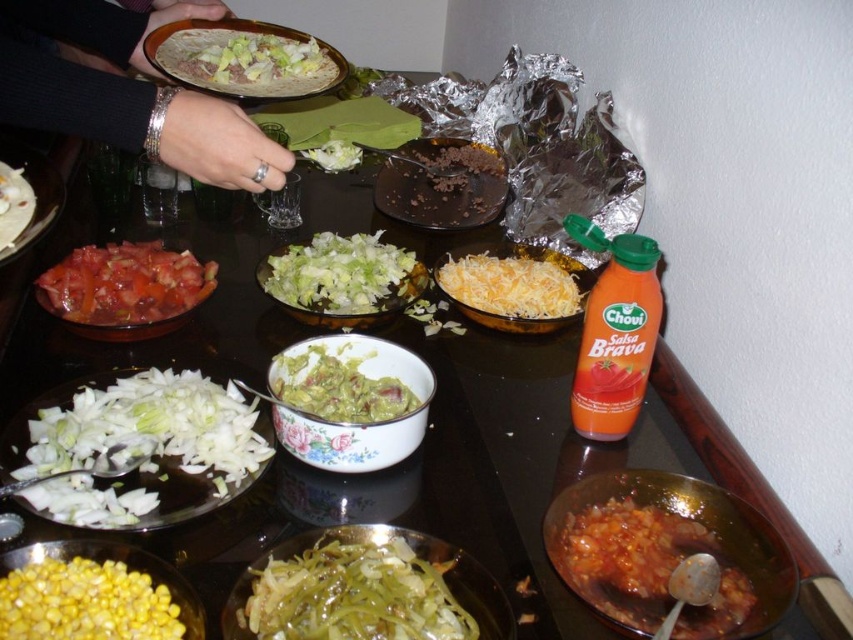
Does white sliced onion at lower left have a greater height compared to green translucent onions at center?

Yes, white sliced onion at lower left is taller than green translucent onions at center.

Does white sliced onion at lower left have a lesser width compared to green translucent onions at center?

No.

The height and width of the screenshot is (640, 853). What do you see at coordinates (146, 449) in the screenshot? I see `white sliced onion at lower left` at bounding box center [146, 449].

At what (x,y) coordinates should I click in order to perform the action: click on white sliced onion at lower left. Please return your answer as a coordinate pair (x, y). The image size is (853, 640). Looking at the image, I should click on (146, 449).

Is green translucent onions at center positioned before white chopped onions at lower left?

Yes, it is in front of white chopped onions at lower left.

Is green translucent onions at center smaller than white chopped onions at lower left?

Indeed, green translucent onions at center has a smaller size compared to white chopped onions at lower left.

Describe the element at coordinates (354, 593) in the screenshot. I see `green translucent onions at center` at that location.

Locate an element on the screen. This screenshot has height=640, width=853. green translucent onions at center is located at coordinates (354, 593).

Between green translucent onions at center and white shredded object at center, which one has less height?

green translucent onions at center

Is green translucent onions at center bigger than white shredded object at center?

Actually, green translucent onions at center might be smaller than white shredded object at center.

Is point (338, 637) less distant than point (302, 301)?

Yes, it is.

Where is `green translucent onions at center`? The width and height of the screenshot is (853, 640). green translucent onions at center is located at coordinates (354, 593).